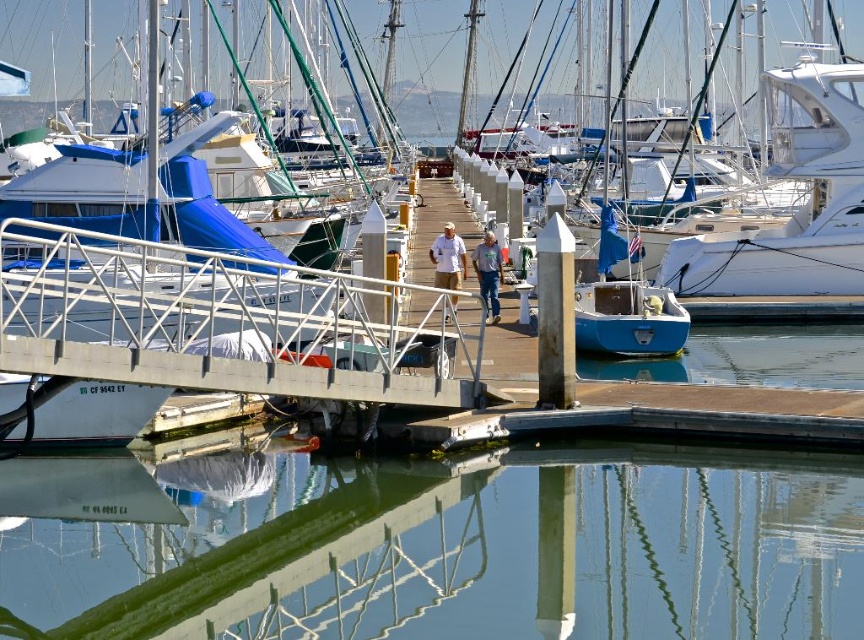
Question: Estimate the real-world distances between objects in this image. Which object is closer to the blue jeans at center?

Choices:
 (A) white matte shirt at center
 (B) clear glass water at center

Answer: (A)

Question: Which point is closer to the camera?

Choices:
 (A) (435, 282)
 (B) (548, 540)

Answer: (B)

Question: Is clear glass water at center to the left of blue jeans at center from the viewer's perspective?

Choices:
 (A) yes
 (B) no

Answer: (A)

Question: Among these objects, which one is farthest from the camera?

Choices:
 (A) blue jeans at center
 (B) clear glass water at center

Answer: (A)

Question: Is clear glass water at center behind blue jeans at center?

Choices:
 (A) yes
 (B) no

Answer: (B)

Question: Can you confirm if clear glass water at center is positioned to the left of blue jeans at center?

Choices:
 (A) no
 (B) yes

Answer: (B)